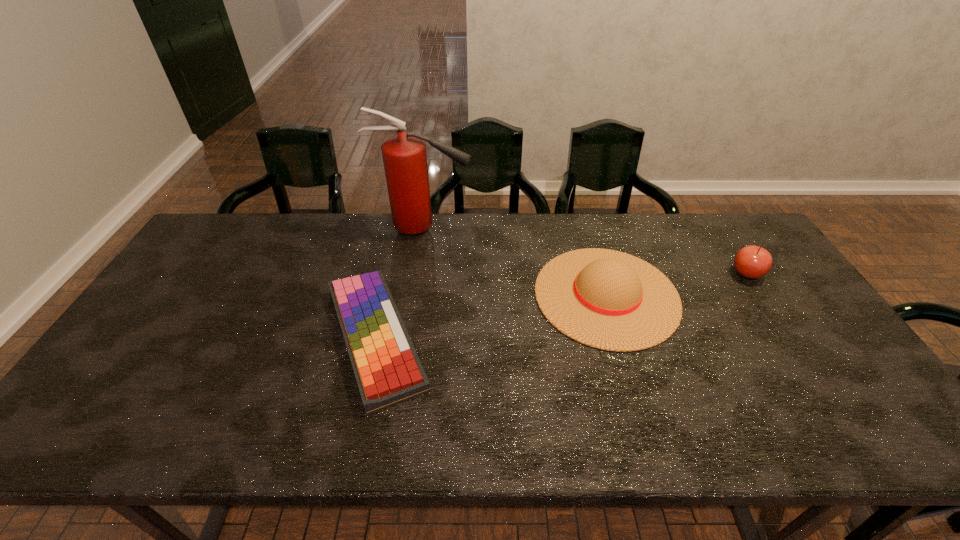
Identify the location of vacant space that satisfies the following two spatial constraints: 1. at the nozzle of the tallest object; 2. on the back side of the bonnet. The width and height of the screenshot is (960, 540). (414, 295).

Locate an element on the screen. The height and width of the screenshot is (540, 960). vacant position in the image that satisfies the following two spatial constraints: 1. on the back side of the second object from right to left; 2. on the right side of the apple is located at coordinates (600, 273).

Locate an element on the screen. vacant space that satisfies the following two spatial constraints: 1. on the back side of the rightmost object; 2. on the left side of the second object from right to left is located at coordinates (600, 273).